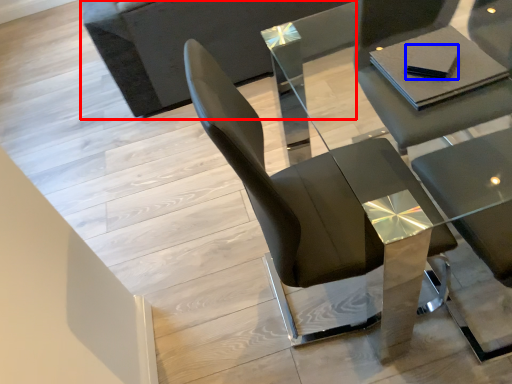
Question: Which point is further to the camera, couch (highlighted by a red box) or pad (highlighted by a blue box)?

Choices:
 (A) couch
 (B) pad

Answer: (A)